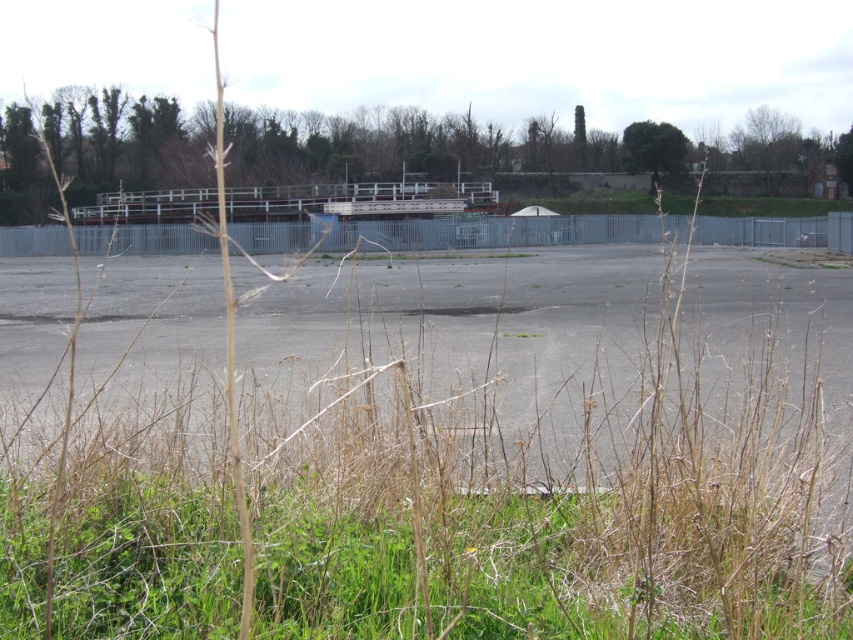
Is green grass at lower center thinner than gray asphalt parking lot at center?

Yes, green grass at lower center is thinner than gray asphalt parking lot at center.

In the scene shown: Does green grass at lower center appear under gray asphalt parking lot at center?

Yes, green grass at lower center is below gray asphalt parking lot at center.

Does point (653, 602) lie behind point (138, 307)?

That is False.

Image resolution: width=853 pixels, height=640 pixels. Find the location of `green grass at lower center`. green grass at lower center is located at coordinates (548, 564).